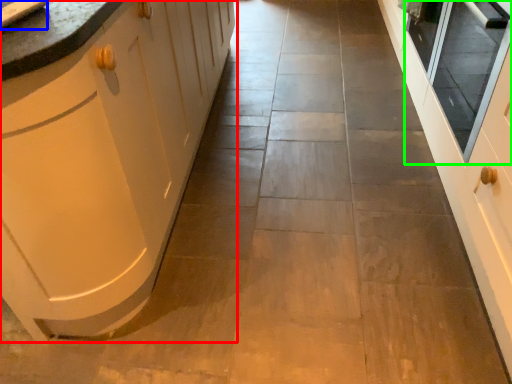
Question: Which object is the closest to the cabinetry (highlighted by a red box)? Choose among these: sink (highlighted by a blue box) or window screen (highlighted by a green box).

Choices:
 (A) sink
 (B) window screen

Answer: (A)